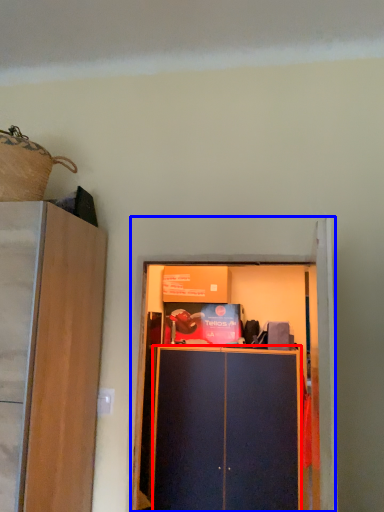
Question: Which object is closer to the camera taking this photo, cabinetry (highlighted by a red box) or cupboard (highlighted by a blue box)?

Choices:
 (A) cabinetry
 (B) cupboard

Answer: (B)